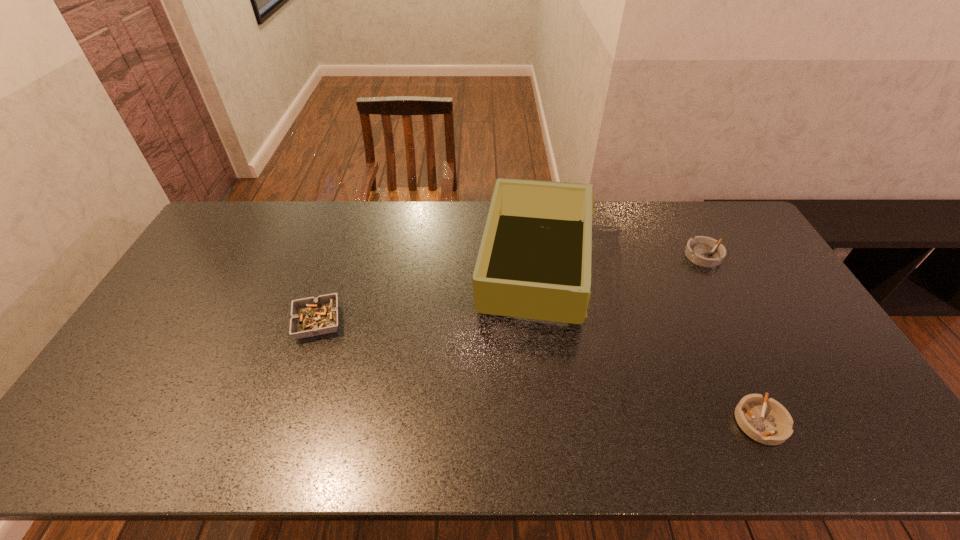
The width and height of the screenshot is (960, 540). In order to click on the second object from left to right in this screenshot , I will do `click(534, 261)`.

Find the location of a particular element. The image size is (960, 540). the tallest object is located at coordinates (534, 261).

Image resolution: width=960 pixels, height=540 pixels. Find the location of `the farthest ashtray`. the farthest ashtray is located at coordinates (704, 251).

Where is `the second nearest ashtray`? Image resolution: width=960 pixels, height=540 pixels. the second nearest ashtray is located at coordinates (311, 316).

I want to click on the leftmost object, so click(x=311, y=316).

This screenshot has height=540, width=960. Find the location of `the nearest ashtray`. the nearest ashtray is located at coordinates (765, 420).

This screenshot has width=960, height=540. Find the location of `vacant space situated on the right of the second object from left to right`. vacant space situated on the right of the second object from left to right is located at coordinates (698, 268).

The height and width of the screenshot is (540, 960). In order to click on free space located on the back of the farthest ashtray in this screenshot , I will do pos(687,224).

Locate an element on the screen. The height and width of the screenshot is (540, 960). vacant area situated 0.270m on the front of the leftmost ashtray is located at coordinates (279, 435).

At what (x,y) coordinates should I click in order to perform the action: click on vacant region located on the left of the nearest object. Please return your answer as a coordinate pair (x, y). The image size is (960, 540). Looking at the image, I should click on (600, 422).